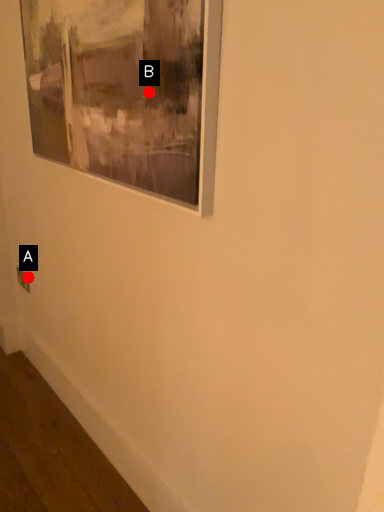
Question: Two points are circled on the image, labeled by A and B beside each circle. Which of the following is the closest to the observer?

Choices:
 (A) A is closer
 (B) B is closer

Answer: (B)